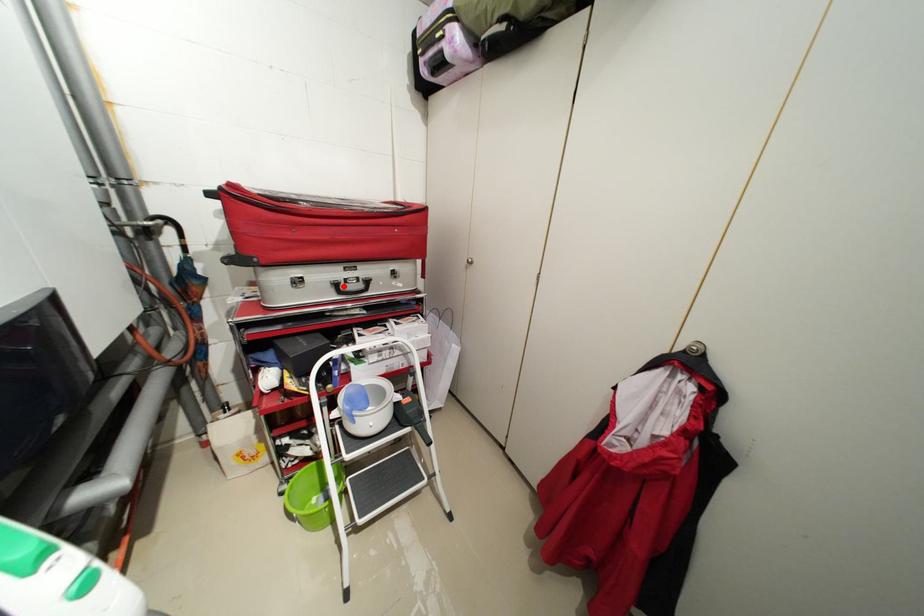
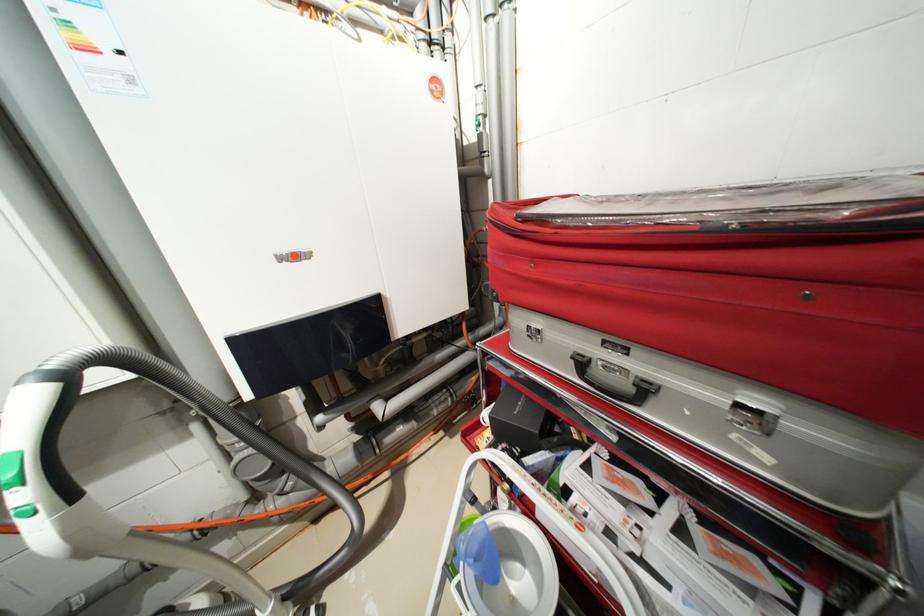
Question: I am providing you with two images of the same scene from different viewpoints. A red point is marked on the first image. At the location where the point appears in image 1, is it still visible in image 2?

Choices:
 (A) Yes
 (B) No

Answer: (A)